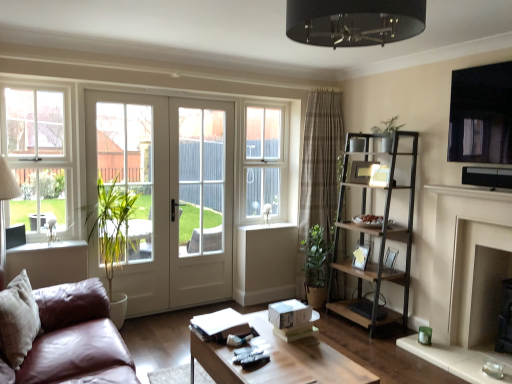
Identify the location of vacant point above white glossy screen door at center (from a real-world perspective). The width and height of the screenshot is (512, 384). (202, 100).